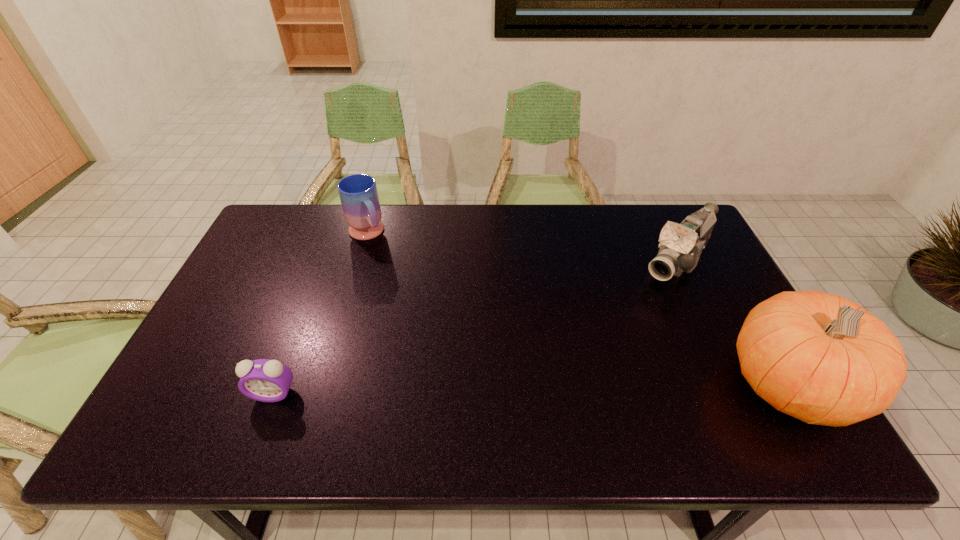
Locate an element on the screen. This screenshot has width=960, height=540. mug positioned at the far edge is located at coordinates (358, 193).

What are the coordinates of `camcorder located in the far edge section of the desktop` in the screenshot? It's located at (681, 245).

This screenshot has width=960, height=540. I want to click on alarm clock at the near edge, so click(x=264, y=380).

Locate an element on the screen. Image resolution: width=960 pixels, height=540 pixels. pumpkin at the near edge is located at coordinates (818, 357).

In order to click on pumpkin that is at the right edge in this screenshot , I will do `click(818, 357)`.

The height and width of the screenshot is (540, 960). Identify the location of camcorder situated at the right edge. (681, 245).

The width and height of the screenshot is (960, 540). What are the coordinates of `object at the far right corner` in the screenshot? It's located at (681, 245).

Where is `object that is positioned at the near right corner`? Image resolution: width=960 pixels, height=540 pixels. object that is positioned at the near right corner is located at coordinates (818, 357).

What are the coordinates of `free space at the far edge of the desktop` in the screenshot? It's located at (540, 216).

Where is `free space at the near edge`? The height and width of the screenshot is (540, 960). free space at the near edge is located at coordinates 456,401.